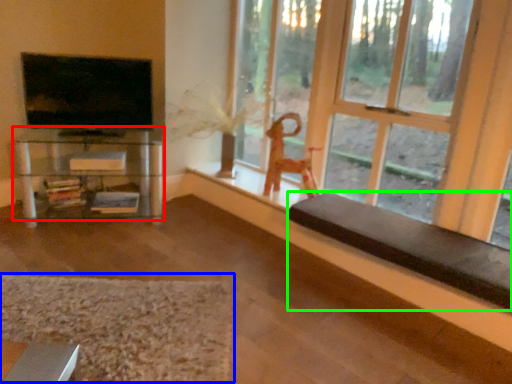
Question: Estimate the real-world distances between objects in this image. Which object is closer to shelf (highlighted by a red box), mat (highlighted by a blue box) or furniture (highlighted by a green box)?

Choices:
 (A) mat
 (B) furniture

Answer: (A)